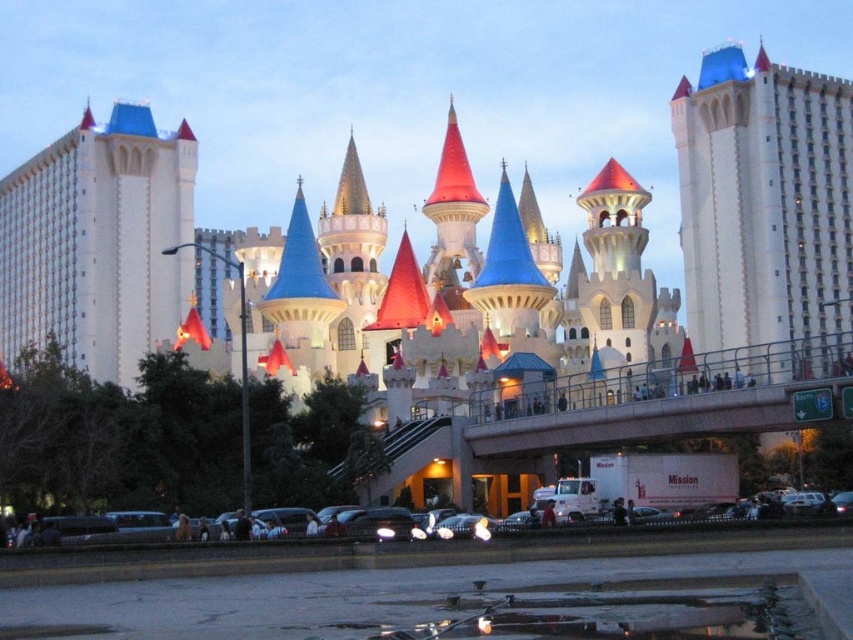
Question: Which object is positioned farthest from the white glossy hotel tower at left?

Choices:
 (A) shiny black car at lower center
 (B) white stone castle at right

Answer: (A)

Question: From the image, what is the correct spatial relationship of white glossy hotel tower at left in relation to shiny black car at lower center?

Choices:
 (A) above
 (B) below

Answer: (A)

Question: Does white stone castle at right appear on the left side of shiny black car at lower center?

Choices:
 (A) no
 (B) yes

Answer: (A)

Question: Which point is farther from the camera taking this photo?

Choices:
 (A) (769, 275)
 (B) (80, 538)
 (C) (108, 154)

Answer: (C)

Question: Which of the following is the farthest from the observer?

Choices:
 (A) shiny black car at lower center
 (B) white stone castle at right

Answer: (B)

Question: Does white glossy hotel tower at left appear on the right side of shiny black car at lower center?

Choices:
 (A) yes
 (B) no

Answer: (B)